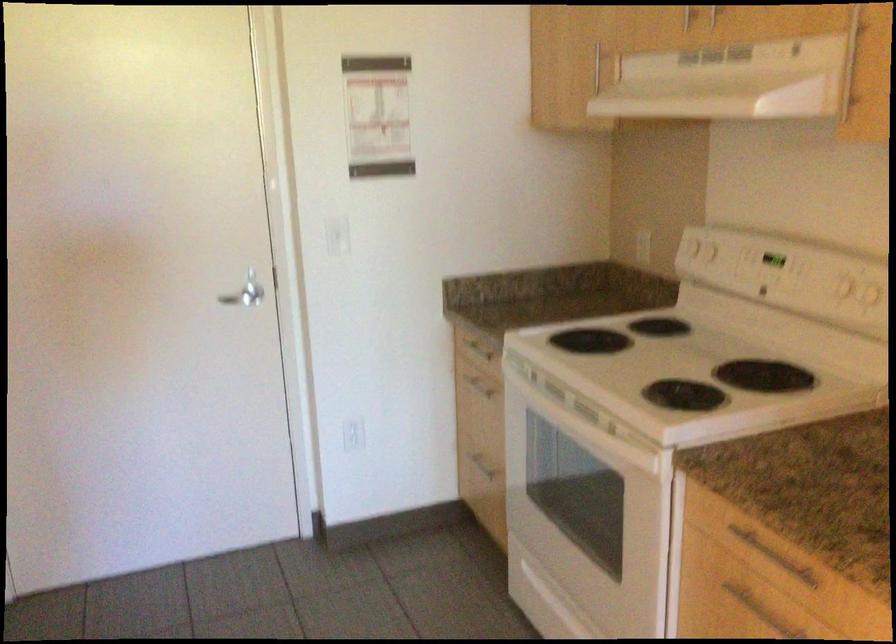
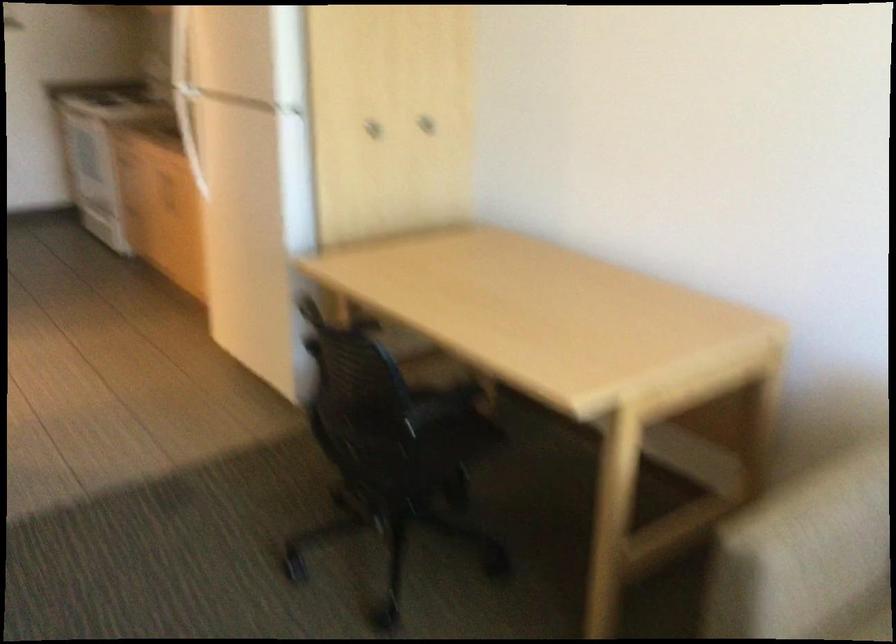
Question: I am providing you with two images of the same scene from different viewpoints. Which of the following objects are not visible in image2?

Choices:
 (A) chair sitting surface
 (B) metal toolbox latch
 (C) refrigerator door handle
 (D) drawer handle

Answer: (D)